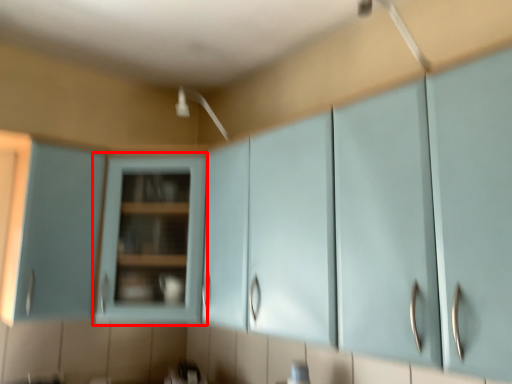
Question: From the image's perspective, what is the correct spatial relationship of cabinetry (annotated by the red box) in relation to cabinetry?

Choices:
 (A) below
 (B) above

Answer: (A)